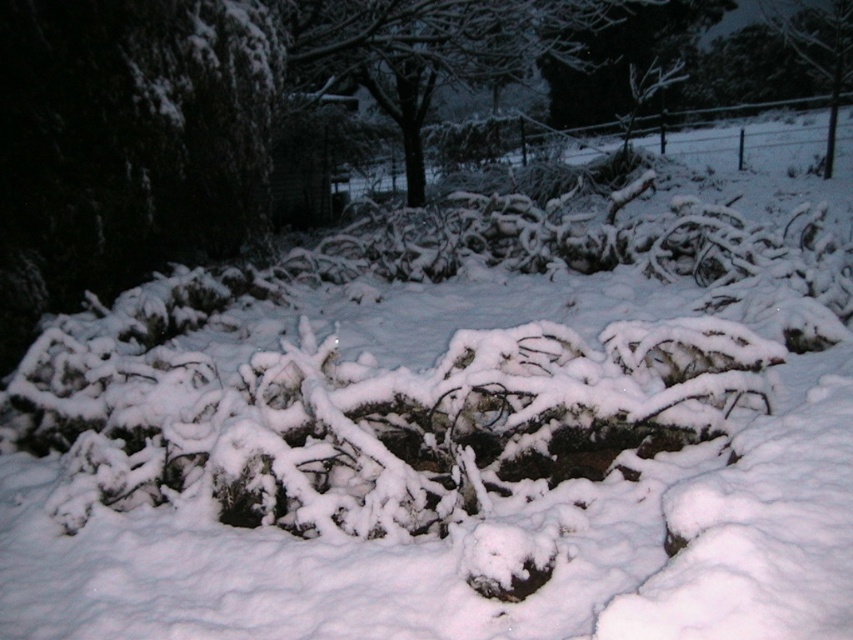
Is point (525, 51) closer to camera compared to point (575, 68)?

Yes, point (525, 51) is closer to viewer.

Who is more distant from viewer, (463, 13) or (567, 113)?

Point (567, 113)

Between point (468, 42) and point (666, 49), which one is positioned in front?

Positioned in front is point (468, 42).

Find the location of a particular element. The image size is (853, 640). snow-covered tree at center is located at coordinates (433, 49).

Does snow-covered tree at center appear under smooth bark tree at upper right?

Indeed, snow-covered tree at center is positioned under smooth bark tree at upper right.

Who is more distant from viewer, (552, 0) or (798, 51)?

The point (552, 0) is behind.

This screenshot has height=640, width=853. What are the coordinates of `snow-covered tree at center` in the screenshot? It's located at (433, 49).

Is snow-covered branches at upper center shorter than smooth bark tree at upper right?

In fact, snow-covered branches at upper center may be taller than smooth bark tree at upper right.

Who is positioned more to the left, snow-covered branches at upper center or smooth bark tree at upper right?

From the viewer's perspective, snow-covered branches at upper center appears more on the left side.

The height and width of the screenshot is (640, 853). What do you see at coordinates (624, 58) in the screenshot?
I see `snow-covered branches at upper center` at bounding box center [624, 58].

Where is `snow-covered branches at upper center`? snow-covered branches at upper center is located at coordinates (624, 58).